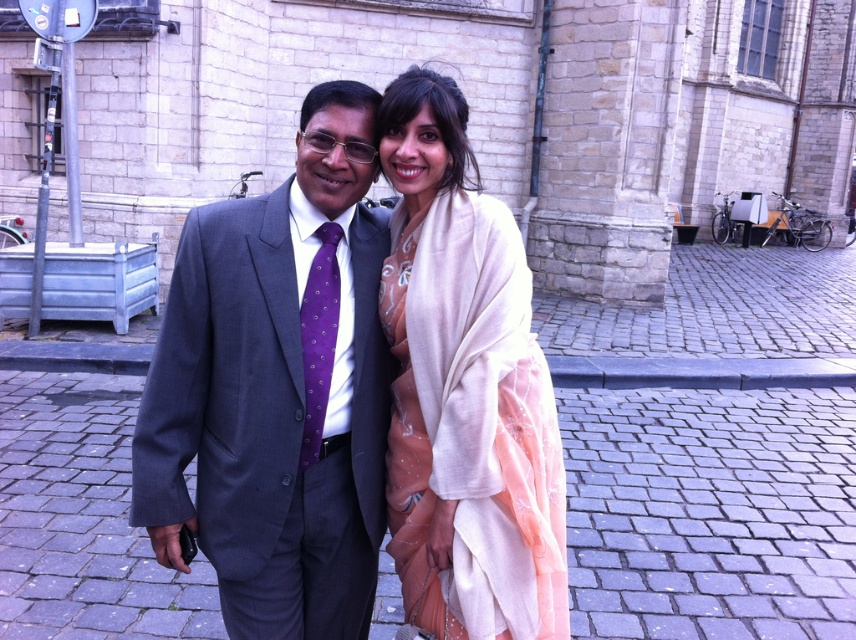
Can you confirm if matte gray suit at center is positioned to the right of purple silk tie at center?

Incorrect, matte gray suit at center is not on the right side of purple silk tie at center.

Based on the photo, does matte gray suit at center have a greater width compared to purple silk tie at center?

Correct, the width of matte gray suit at center exceeds that of purple silk tie at center.

From the picture: Who is more forward, (169,388) or (337,314)?

Point (169,388)

I want to click on matte gray suit at center, so click(277, 388).

Does pale beige silk scarf at center have a smaller size compared to purple silk tie at center?

Actually, pale beige silk scarf at center might be larger than purple silk tie at center.

Does point (407, 230) come closer to viewer compared to point (336, 225)?

No.

The height and width of the screenshot is (640, 856). I want to click on pale beige silk scarf at center, so click(x=464, y=388).

Image resolution: width=856 pixels, height=640 pixels. I want to click on pale beige silk scarf at center, so [464, 388].

Which is behind, point (241, 496) or point (538, 563)?

The point (538, 563) is more distant.

Can you confirm if matte gray suit at center is wider than pale beige silk scarf at center?

Yes.

At what (x,y) coordinates should I click in order to perform the action: click on matte gray suit at center. Please return your answer as a coordinate pair (x, y). The image size is (856, 640). Looking at the image, I should click on (277, 388).